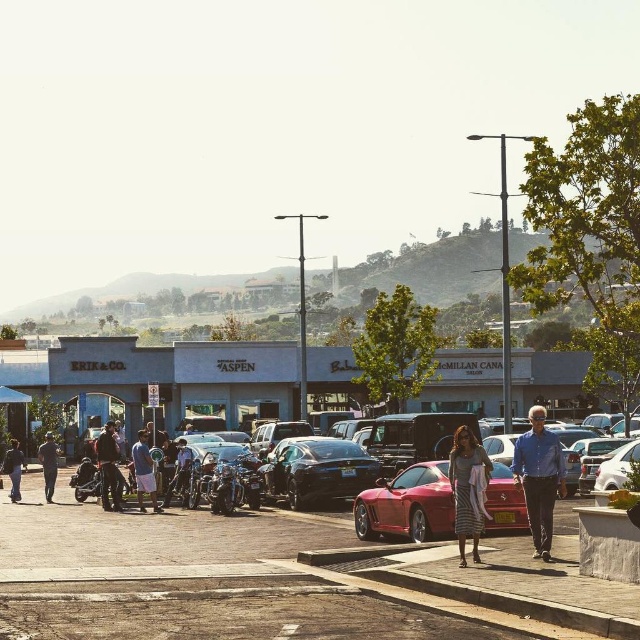
Is shiny chrome motorcycle at center-left to the right of dark blue jeans at lower left from the viewer's perspective?

Yes, shiny chrome motorcycle at center-left is to the right of dark blue jeans at lower left.

Which is above, shiny chrome motorcycle at center-left or dark blue jeans at lower left?

shiny chrome motorcycle at center-left is higher up.

Where is `shiny chrome motorcycle at center-left`? shiny chrome motorcycle at center-left is located at coordinates click(x=84, y=481).

Which is in front, point (531, 458) or point (145, 465)?

Point (531, 458)

Between blue shirt at center and blue denim shorts at center, which one appears on the right side from the viewer's perspective?

Positioned to the right is blue shirt at center.

Describe the element at coordinates (538, 477) in the screenshot. The height and width of the screenshot is (640, 640). I see `blue shirt at center` at that location.

You are a GUI agent. You are given a task and a screenshot of the screen. Output one action in this format:
    pyautogui.click(x=<x>, y=<y>)
    Task: Click on the blue shirt at center
    The height and width of the screenshot is (640, 640).
    Given the screenshot: What is the action you would take?
    pyautogui.click(x=538, y=477)

Between striped dress at center and dark blue jeans at center, which one is positioned lower?

dark blue jeans at center is lower down.

Is point (483, 513) in front of point (99, 444)?

Yes, it is.

This screenshot has height=640, width=640. I want to click on striped dress at center, so click(x=467, y=490).

Find the location of a particular element. The height and width of the screenshot is (640, 640). striped dress at center is located at coordinates (467, 490).